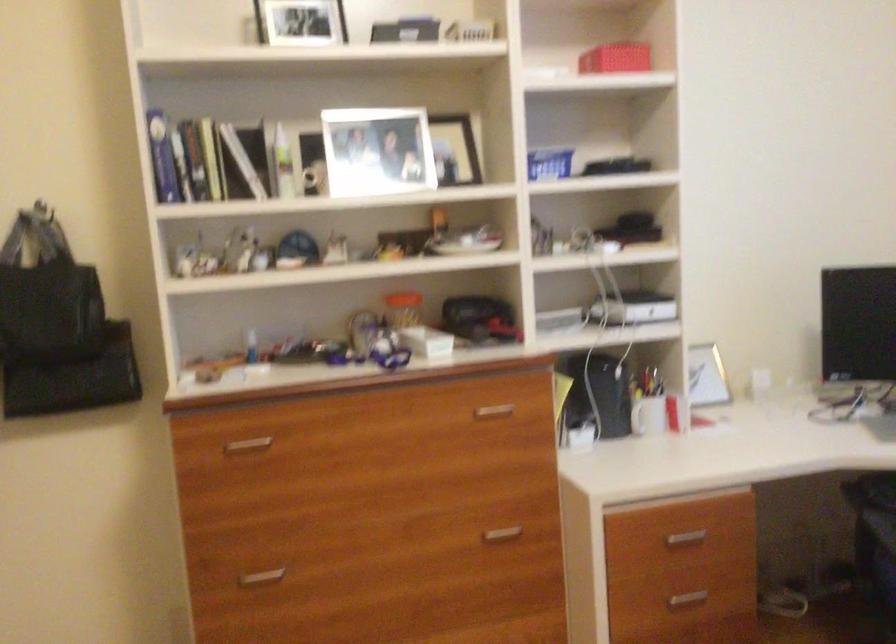
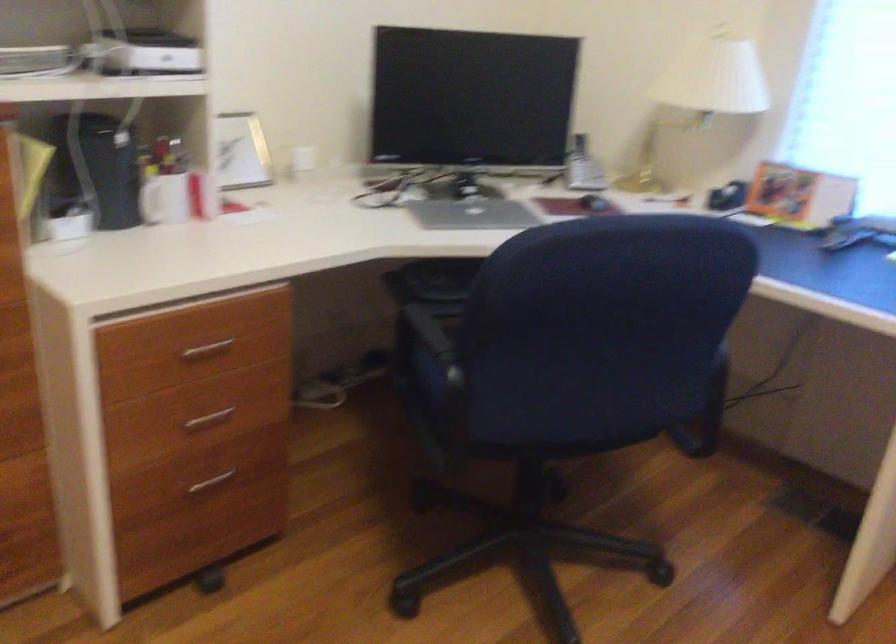
Question: The camera is either moving clockwise (left) or counter-clockwise (right) around the object. The first image is from the beginning of the video and the second image is from the end. Is the camera moving left or right when shooting the video?

Choices:
 (A) Left
 (B) Right

Answer: (A)